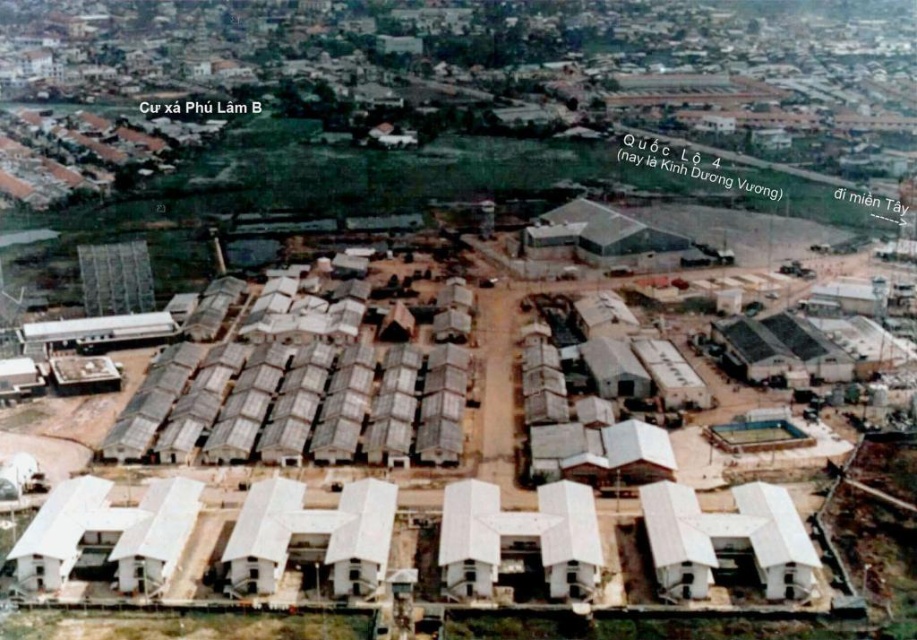
Question: Can you confirm if rustic wood hut at center is positioned to the left of gray corrugated metal hut at center?

Choices:
 (A) yes
 (B) no

Answer: (A)

Question: Which point is closer to the camera taking this photo?

Choices:
 (A) (763, 488)
 (B) (675, 259)
 (C) (208, 378)

Answer: (A)

Question: Is white corrugated metal hut at lower right further to camera compared to gray corrugated metal hut at center?

Choices:
 (A) yes
 (B) no

Answer: (B)

Question: Which of the following is the closest to the observer?

Choices:
 (A) (440, 426)
 (B) (768, 515)
 (C) (649, 232)

Answer: (B)

Question: Does rustic wood hut at center appear under white corrugated metal hut at lower right?

Choices:
 (A) yes
 (B) no

Answer: (B)

Question: Among these objects, which one is farthest from the camera?

Choices:
 (A) gray corrugated metal hut at center
 (B) white corrugated metal hut at lower right

Answer: (A)